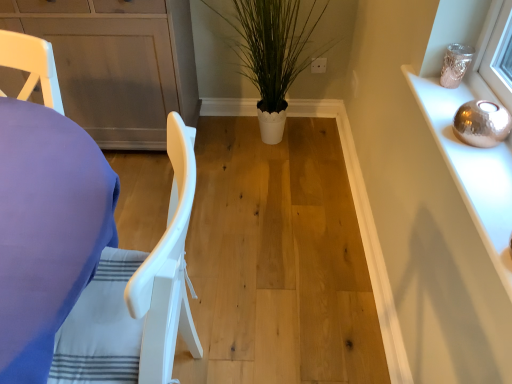
What is the approximate height of matte gray cabinet at center, which is the second cabinetry from front to back?

matte gray cabinet at center, which is the second cabinetry from front to back, is 79.33 centimeters tall.

What are the coordinates of `white plastic chair at left` in the screenshot? It's located at (136, 297).

Describe the element at coordinates (471, 169) in the screenshot. I see `silver metallic sphere at upper right, which is the 1th cabinetry in front-to-back order` at that location.

The height and width of the screenshot is (384, 512). Find the location of `matte gray cabinet at center, marked as the 1th cabinetry in a back-to-front arrangement`. matte gray cabinet at center, marked as the 1th cabinetry in a back-to-front arrangement is located at coordinates (117, 64).

From a real-world perspective, is silver metallic sphere at upper right, the first cabinetry viewed from the right, physically below green leafy plant at center?

No, from a real-world perspective, silver metallic sphere at upper right, the first cabinetry viewed from the right, is not beneath green leafy plant at center.

Is silver metallic sphere at upper right, which is the 1th cabinetry in front-to-back order, oriented towards green leafy plant at center?

No, silver metallic sphere at upper right, which is the 1th cabinetry in front-to-back order, is not facing towards green leafy plant at center.

Choose the correct answer: Is silver metallic sphere at upper right, which is the 1th cabinetry in front-to-back order, inside green leafy plant at center or outside it?

The correct answer is: outside.

Looking at the image, does silver metallic sphere at upper right, which is the 1th cabinetry in front-to-back order, seem bigger or smaller compared to green leafy plant at center?

silver metallic sphere at upper right, which is the 1th cabinetry in front-to-back order, is smaller than green leafy plant at center.

From a real-world perspective, which is physically below, green leafy plant at center or silver metallic sphere at upper right, which is the 1th cabinetry in front-to-back order?

From a 3D spatial view, green leafy plant at center is below.

How many degrees apart are the facing directions of green leafy plant at center and silver metallic sphere at upper right, which is counted as the second cabinetry, starting from the back?

The angle between the facing direction of green leafy plant at center and the facing direction of silver metallic sphere at upper right, which is counted as the second cabinetry, starting from the back, is 92.7 degrees.

Is green leafy plant at center inside or outside of silver metallic sphere at upper right, the first cabinetry viewed from the right?

The correct answer is: outside.

From the image's perspective, is green leafy plant at center positioned above or below silver metallic sphere at upper right, which is the 1th cabinetry in front-to-back order?

Clearly, from the image's perspective, green leafy plant at center is above silver metallic sphere at upper right, which is the 1th cabinetry in front-to-back order.

Which of these two, matte gray cabinet at center, which is the 1th cabinetry from left to right, or green leafy plant at center, is wider?

Wider between the two is green leafy plant at center.

Is matte gray cabinet at center, the 2th cabinetry positioned from the right, inside the boundaries of green leafy plant at center, or outside?

The correct answer is: outside.

Is matte gray cabinet at center, the 2th cabinetry positioned from the right, positioned before green leafy plant at center?

That is False.

How many degrees apart are the facing directions of matte gray cabinet at center, the 2th cabinetry positioned from the right, and silver metallic sphere at upper right, the first cabinetry viewed from the right?

There is a 91-degree angle between the facing directions of matte gray cabinet at center, the 2th cabinetry positioned from the right, and silver metallic sphere at upper right, the first cabinetry viewed from the right.

Is matte gray cabinet at center, marked as the 1th cabinetry in a back-to-front arrangement, situated inside silver metallic sphere at upper right, which is the 1th cabinetry in front-to-back order, or outside?

matte gray cabinet at center, marked as the 1th cabinetry in a back-to-front arrangement, lies outside silver metallic sphere at upper right, which is the 1th cabinetry in front-to-back order.

From the picture: Which of these two, matte gray cabinet at center, which is the second cabinetry from front to back, or silver metallic sphere at upper right, the 2th cabinetry when ordered from left to right, is wider?

matte gray cabinet at center, which is the second cabinetry from front to back.

Which is nearer, (173, 54) or (452, 121)?

Clearly, point (173, 54) is more distant from the camera than point (452, 121).

How different are the orientations of green leafy plant at center and matte gray cabinet at center, the 2th cabinetry positioned from the right, in degrees?

There is a 1.71-degree angle between the facing directions of green leafy plant at center and matte gray cabinet at center, the 2th cabinetry positioned from the right.

Considering the points (277, 142) and (193, 75), which point is in front, point (277, 142) or point (193, 75)?

The point (193, 75) is more forward.

Is green leafy plant at center not inside matte gray cabinet at center, the 2th cabinetry positioned from the right?

Yes, green leafy plant at center is outside of matte gray cabinet at center, the 2th cabinetry positioned from the right.

Could you tell me if green leafy plant at center is facing matte gray cabinet at center, which is the 1th cabinetry from left to right?

No, green leafy plant at center does not turn towards matte gray cabinet at center, which is the 1th cabinetry from left to right.

From a real-world perspective, is green leafy plant at center positioned under white plastic chair at left based on gravity?

No, from a real-world perspective, green leafy plant at center is not beneath white plastic chair at left.

Does point (211, 9) appear closer or farther from the camera than point (129, 297)?

Clearly, point (211, 9) is more distant from the camera than point (129, 297).

Locate an element on the screen. This screenshot has height=384, width=512. chair on the left of green leafy plant at center is located at coordinates (136, 297).

Relative to white plastic chair at left, is green leafy plant at center in front or behind?

In the image, green leafy plant at center appears behind white plastic chair at left.

Considering the points (504, 265) and (189, 53), which point is behind, point (504, 265) or point (189, 53)?

The point (189, 53) is farther.

Consider the image. Visually, is silver metallic sphere at upper right, the 2th cabinetry when ordered from left to right, positioned to the left or to the right of matte gray cabinet at center, marked as the 1th cabinetry in a back-to-front arrangement?

Based on their positions, silver metallic sphere at upper right, the 2th cabinetry when ordered from left to right, is located to the right of matte gray cabinet at center, marked as the 1th cabinetry in a back-to-front arrangement.

From the image's perspective, is silver metallic sphere at upper right, the 2th cabinetry when ordered from left to right, below matte gray cabinet at center, the 2th cabinetry positioned from the right?

Yes.

From the picture: From a real-world perspective, is silver metallic sphere at upper right, the 2th cabinetry when ordered from left to right, located higher than matte gray cabinet at center, marked as the 1th cabinetry in a back-to-front arrangement?

Yes, from a real-world perspective, silver metallic sphere at upper right, the 2th cabinetry when ordered from left to right, is above matte gray cabinet at center, marked as the 1th cabinetry in a back-to-front arrangement.

You are a GUI agent. You are given a task and a screenshot of the screen. Output one action in this format:
    pyautogui.click(x=<x>, y=<y>)
    Task: Click on the houseplant below the silver metallic sphere at upper right, the 2th cabinetry when ordered from left to right (from a real-world perspective)
    The height and width of the screenshot is (384, 512).
    Given the screenshot: What is the action you would take?
    pyautogui.click(x=272, y=53)

Where is `cabinetry on the right of green leafy plant at center`? This screenshot has height=384, width=512. cabinetry on the right of green leafy plant at center is located at coordinates (471, 169).

Based on their spatial positions, is white plastic chair at left or green leafy plant at center closer to matte gray cabinet at center, which is the 1th cabinetry from left to right?

Based on the image, green leafy plant at center appears to be nearer to matte gray cabinet at center, which is the 1th cabinetry from left to right.

Based on their spatial positions, is white plastic chair at left or green leafy plant at center further from silver metallic sphere at upper right, which is counted as the second cabinetry, starting from the back?

Among the two, green leafy plant at center is located further to silver metallic sphere at upper right, which is counted as the second cabinetry, starting from the back.

Looking at the image, which one is located further to green leafy plant at center, silver metallic sphere at upper right, which is the 1th cabinetry in front-to-back order, or white plastic chair at left?

Among the two, white plastic chair at left is located further to green leafy plant at center.

From the picture: Which object lies nearer to the anchor point green leafy plant at center, silver metallic sphere at upper right, which is the 1th cabinetry in front-to-back order, or matte gray cabinet at center, which is the second cabinetry from front to back?

Among the two, matte gray cabinet at center, which is the second cabinetry from front to back, is located nearer to green leafy plant at center.

Looking at this image, which object lies nearer to the anchor point white plastic chair at left, silver metallic sphere at upper right, the first cabinetry viewed from the right, or matte gray cabinet at center, which is the 1th cabinetry from left to right?

silver metallic sphere at upper right, the first cabinetry viewed from the right, lies closer to white plastic chair at left than the other object.

Considering their positions, is green leafy plant at center positioned further to white plastic chair at left than matte gray cabinet at center, which is the second cabinetry from front to back?

green leafy plant at center lies further to white plastic chair at left than the other object.

Looking at the image, which one is located closer to matte gray cabinet at center, which is the 1th cabinetry from left to right, white plastic chair at left or silver metallic sphere at upper right, the first cabinetry viewed from the right?

white plastic chair at left.

Which object lies nearer to the anchor point green leafy plant at center, white plastic chair at left or matte gray cabinet at center, marked as the 1th cabinetry in a back-to-front arrangement?

Based on the image, matte gray cabinet at center, marked as the 1th cabinetry in a back-to-front arrangement, appears to be nearer to green leafy plant at center.

Identify the location of houseplant between white plastic chair at left and matte gray cabinet at center, which is the 1th cabinetry from left to right, from front to back. 272,53.

This screenshot has width=512, height=384. I want to click on cabinetry located between white plastic chair at left and green leafy plant at center in the depth direction, so click(x=471, y=169).

At what (x,y) coordinates should I click in order to perform the action: click on houseplant located between matte gray cabinet at center, which is the 1th cabinetry from left to right, and silver metallic sphere at upper right, which is counted as the second cabinetry, starting from the back, in the left-right direction. Please return your answer as a coordinate pair (x, y). The height and width of the screenshot is (384, 512). Looking at the image, I should click on (272, 53).

Where is `chair between matte gray cabinet at center, which is the second cabinetry from front to back, and silver metallic sphere at upper right, which is counted as the second cabinetry, starting from the back, from left to right`? Image resolution: width=512 pixels, height=384 pixels. chair between matte gray cabinet at center, which is the second cabinetry from front to back, and silver metallic sphere at upper right, which is counted as the second cabinetry, starting from the back, from left to right is located at coordinates (136, 297).